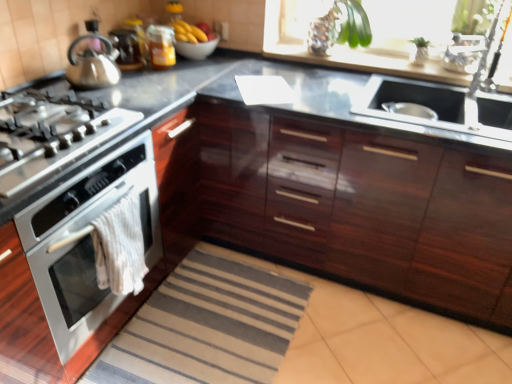
Question: Visually, is satin silver gas stove at left positioned to the left or to the right of satin steel sink at center right?

Choices:
 (A) left
 (B) right

Answer: (A)

Question: Is point pos(28,99) positioned closer to the camera than point pos(463,99)?

Choices:
 (A) closer
 (B) farther

Answer: (A)

Question: Which is farther from the satin nickel faucet at upper right?

Choices:
 (A) shiny metallic kettle at upper left
 (B) satin steel sink at center right
 (C) white towel at lower left
 (D) satin silver gas stove at left
 (E) yellow matte bananas at upper center

Answer: (A)

Question: Estimate the real-world distances between objects in this image. Which object is closer to the white towel at lower left?

Choices:
 (A) glossy wood cabinetry at center
 (B) satin nickel faucet at upper right
 (C) metallic silver kettle at upper left
 (D) satin silver gas stove at left
 (E) yellow matte bananas at upper center

Answer: (D)